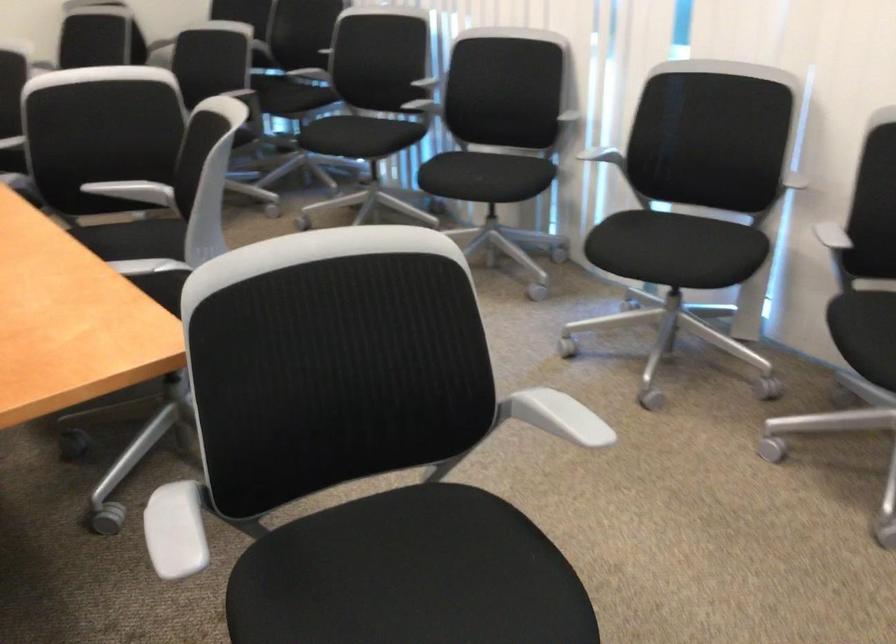
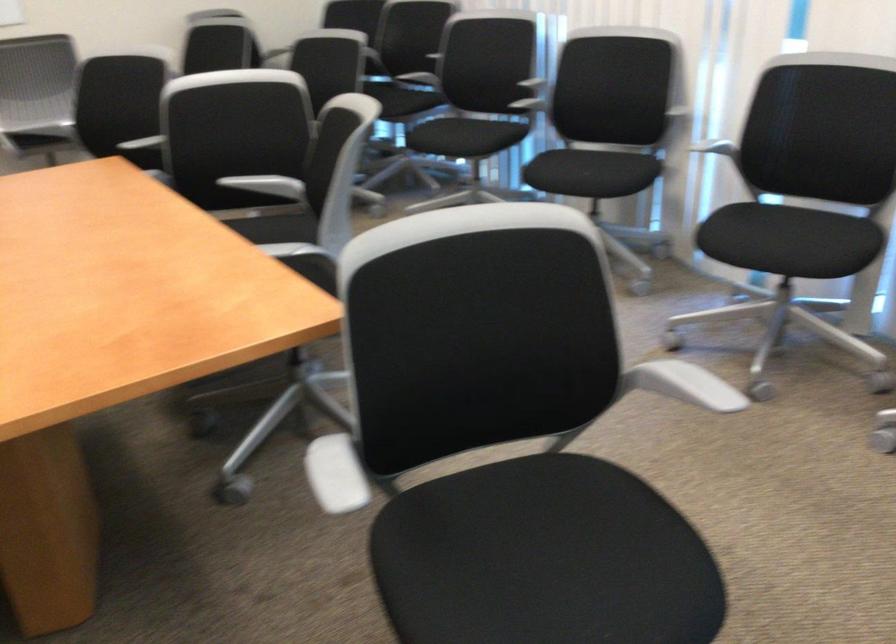
The point at (192, 526) is marked in the first image. Where is the corresponding point in the second image?

(334, 474)